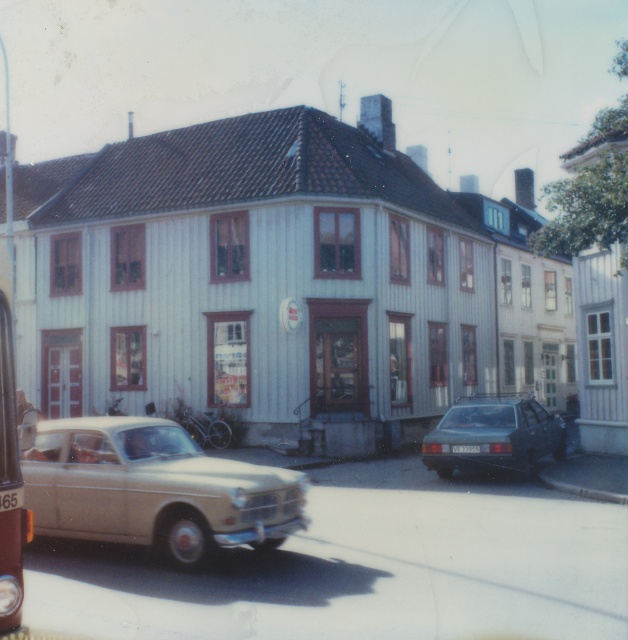
Question: Is metallic silver bus at left closer to camera compared to white plastic license plate at center?

Choices:
 (A) no
 (B) yes

Answer: (B)

Question: Among these objects, which one is farthest from the camera?

Choices:
 (A) white plastic license plate at center
 (B) matte black car at lower right

Answer: (A)

Question: Can you confirm if beige matte car at left is thinner than metallic silver bus at left?

Choices:
 (A) no
 (B) yes

Answer: (A)

Question: Is beige matte car at left smaller than matte black car at lower right?

Choices:
 (A) no
 (B) yes

Answer: (B)

Question: Which of the following is the closest to the observer?

Choices:
 (A) beige matte car at left
 (B) metallic silver bus at left
 (C) matte black car at lower right
 (D) white plastic license plate at center

Answer: (B)

Question: Which object is positioned closest to the white plastic license plate at center?

Choices:
 (A) beige matte car at left
 (B) matte black car at lower right
 (C) metallic silver bus at left

Answer: (B)